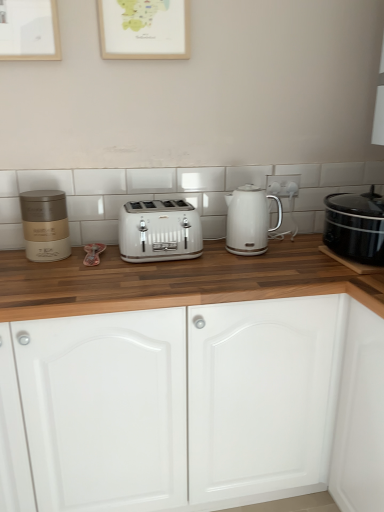
At what (x,y) coordinates should I click in order to perform the action: click on blank space situated above white metallic toaster at center (from a real-world perspective). Please return your answer as a coordinate pair (x, y). Image resolution: width=384 pixels, height=512 pixels. Looking at the image, I should click on (165, 206).